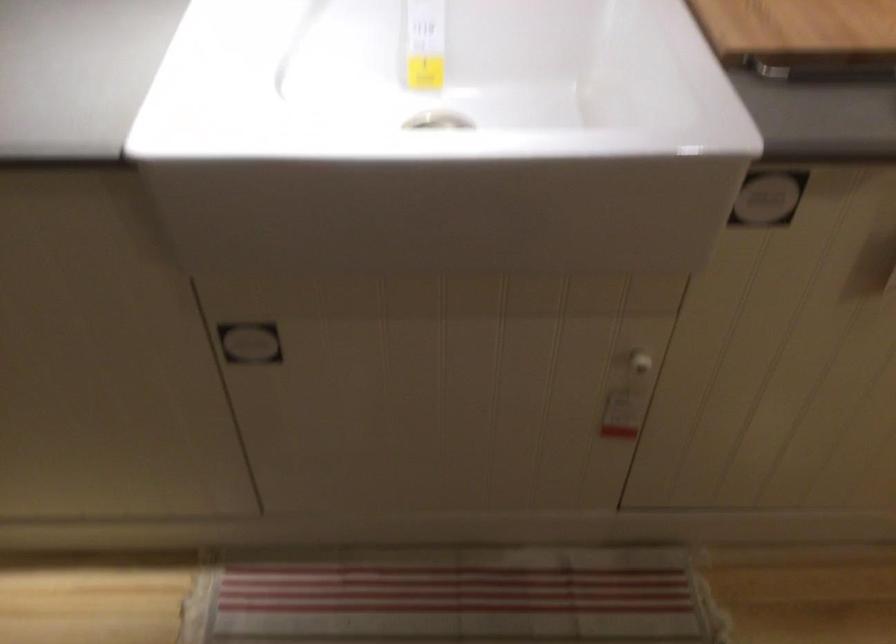
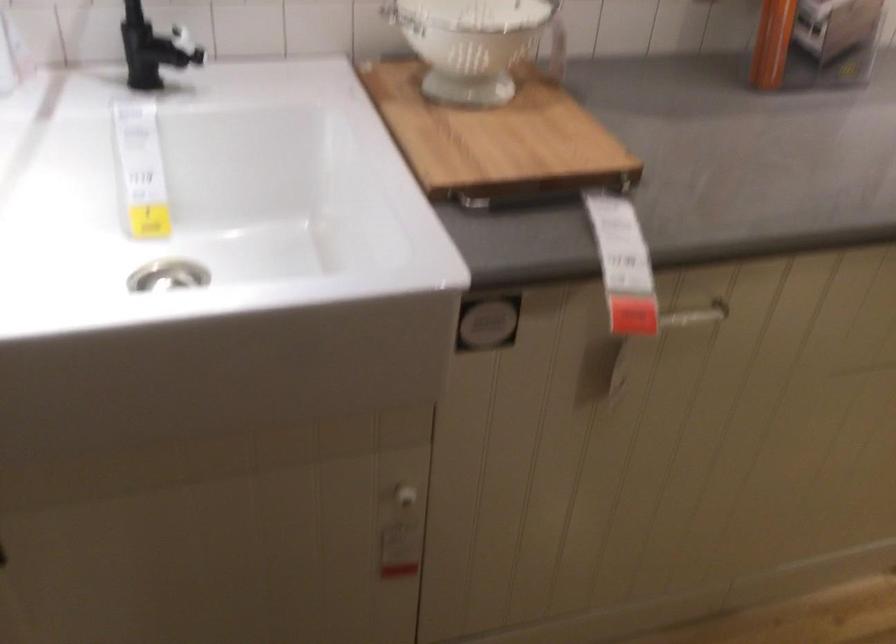
Question: How did the camera likely rotate?

Choices:
 (A) Left
 (B) Right
 (C) Up
 (D) Down

Answer: (B)